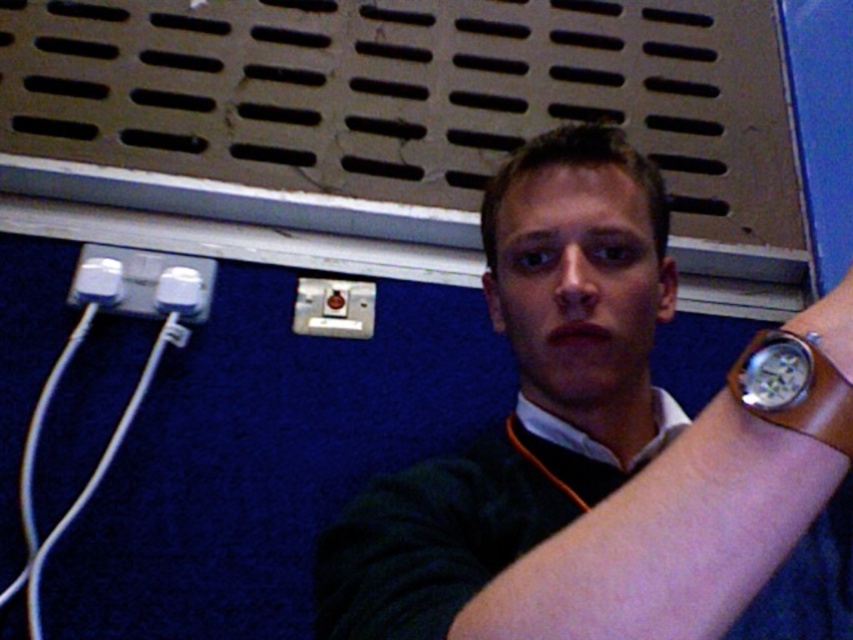
Question: Is brown leather watch at upper right further to camera compared to silver metallic watch at upper right?

Choices:
 (A) no
 (B) yes

Answer: (A)

Question: Among these points, which one is farthest from the camera?

Choices:
 (A) (328, 298)
 (B) (70, 301)

Answer: (A)

Question: In this image, where is brown leather watch at upper right located relative to white plastic plug at left?

Choices:
 (A) right
 (B) left

Answer: (A)

Question: Which of the following is the closest to the observer?

Choices:
 (A) metallic silver plug at center
 (B) brown leather watch at upper right
 (C) silver metallic watch at upper right
 (D) white plastic plug at left

Answer: (B)

Question: Is brown leather watch at upper right wider than silver metallic watch at upper right?

Choices:
 (A) yes
 (B) no

Answer: (A)

Question: Which object is the closest to the silver metallic watch at upper right?

Choices:
 (A) brown leather watch at upper right
 (B) metallic silver plug at center
 (C) white plastic plug at left

Answer: (A)